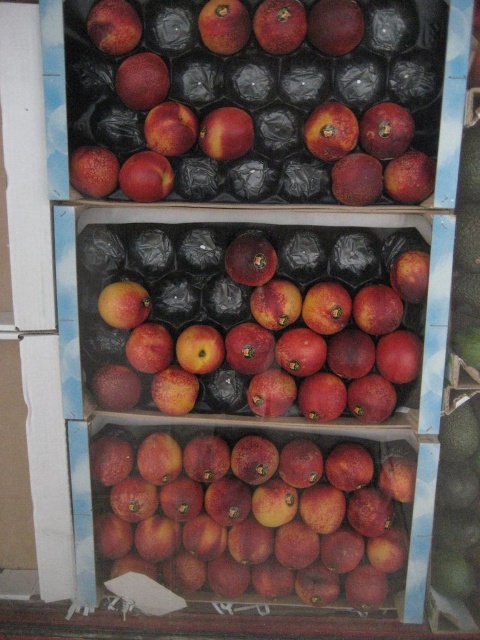
You are a fruit seller who needs to arrange fruits by size. You have a glossy red apple at center and a matte peach at upper center. Which fruit should you place in the small fruit section?

The glossy red apple at center should be placed in the small fruit section because it has a smaller size compared to the matte peach at upper center.

You are a delivery person who needs to place a new box of grapes between the two points, point (347, 392) and point (146, 122). Since the grapes box must be placed in front of the existing display, which point should you align the front of the box with?

You should align the front of the grapes box with point (347, 392) because it is closer to the viewer than point (146, 122), ensuring the new box is positioned in front of the existing display.

You are a fruit seller who wants to place a price tag on the largest fruit in the display. Which fruit should you choose between the glossy red peach at upper center and the glossy red apple at center?

The glossy red peach at upper center is larger in size than the glossy red apple at center, so you should place the price tag on the glossy red peach at upper center.